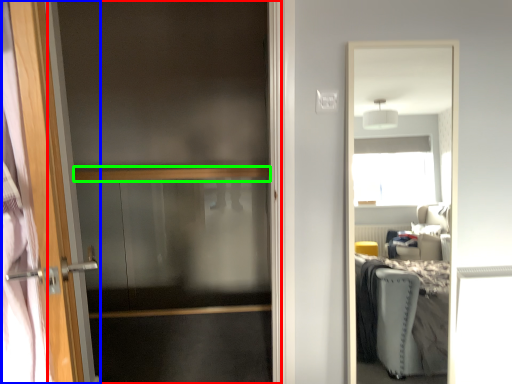
Question: Considering the real-world distances, which object is farthest from screen door (highlighted by a red box)? door (highlighted by a blue box) or balustrade (highlighted by a green box)?

Choices:
 (A) door
 (B) balustrade

Answer: (A)